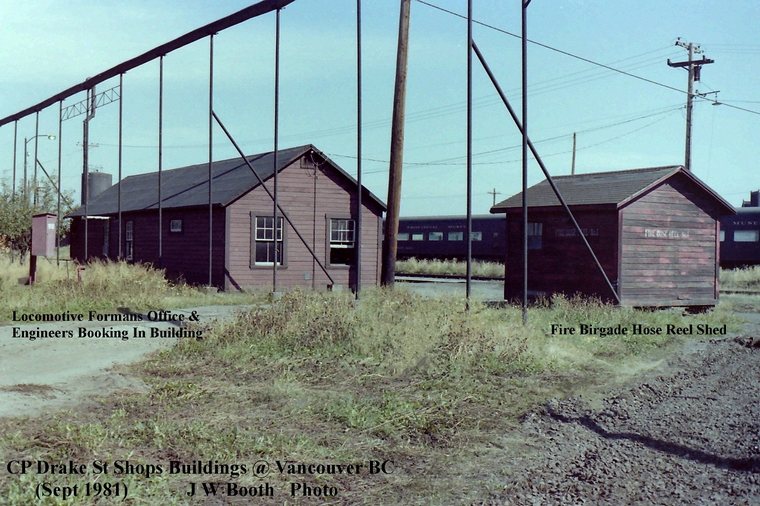
Where is `small window on house`? small window on house is located at coordinates (175, 222).